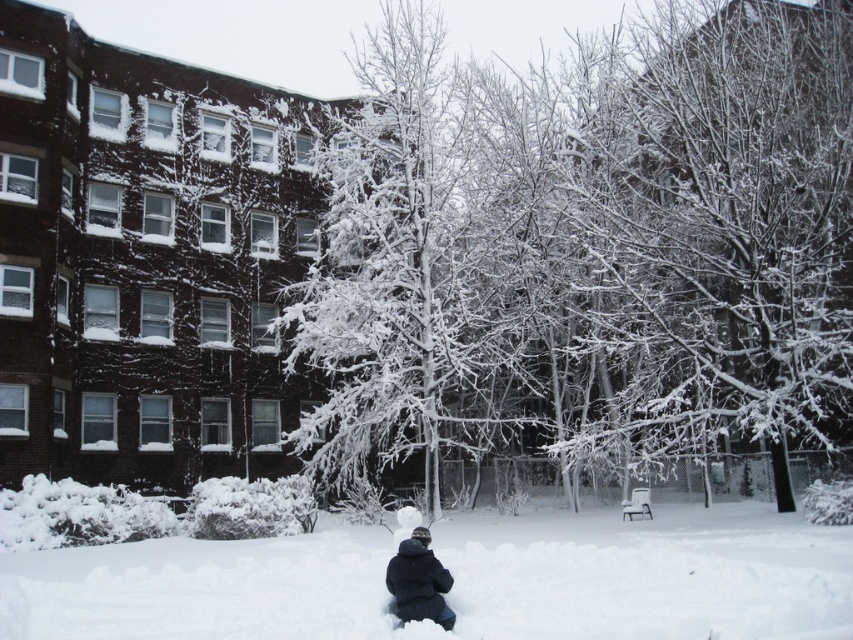
Is white fluffy snow at lower center thinner than black fuzzy jacket at lower center?

No, white fluffy snow at lower center is not thinner than black fuzzy jacket at lower center.

Which is more to the left, white fluffy snow at lower center or black fuzzy jacket at lower center?

Positioned to the left is black fuzzy jacket at lower center.

Between point (476, 547) and point (447, 627), which one is positioned in front?

Point (447, 627) is more forward.

This screenshot has height=640, width=853. I want to click on white fluffy snow at lower center, so click(456, 579).

Who is positioned more to the right, white frosty tree at center or white fluffy snow at lower center?

white frosty tree at center is more to the right.

Does white frosty tree at center have a lesser width compared to white fluffy snow at lower center?

No.

You are a GUI agent. You are given a task and a screenshot of the screen. Output one action in this format:
    pyautogui.click(x=<x>, y=<y>)
    Task: Click on the white frosty tree at center
    Image resolution: width=853 pixels, height=640 pixels.
    Given the screenshot: What is the action you would take?
    pyautogui.click(x=590, y=244)

Does point (399, 413) come behind point (399, 600)?

Yes, point (399, 413) is farther from viewer.

Does white frosty tree at center have a lesser height compared to black fuzzy jacket at lower center?

No.

Is point (631, 396) in front of point (398, 602)?

No, it is not.

This screenshot has height=640, width=853. Find the location of `white frosty tree at center`. white frosty tree at center is located at coordinates (590, 244).